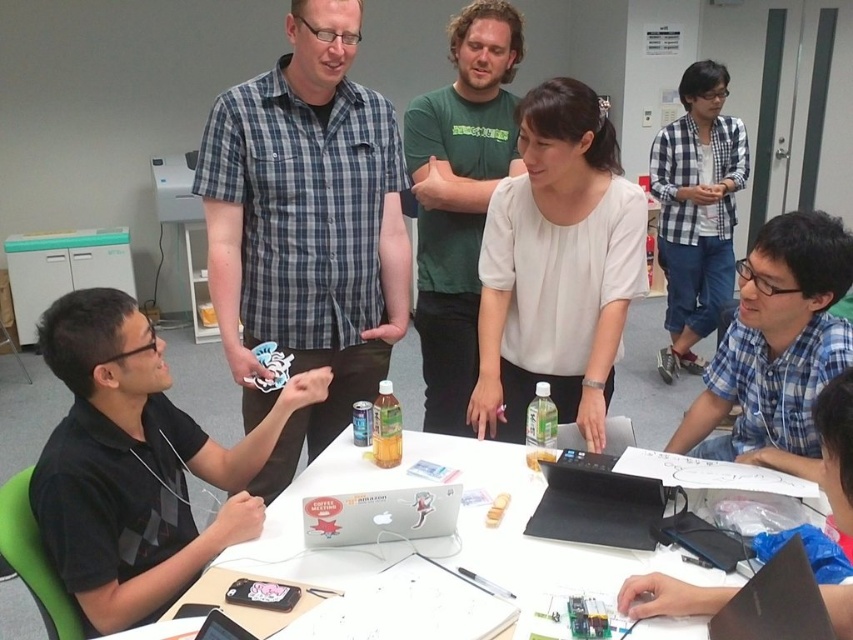
Question: Which point is farther to the camera?

Choices:
 (A) blue plaid shirt at center
 (B) blue plaid shirt at lower right
 (C) green cotton shirt at center

Answer: (C)

Question: Which point appears farthest from the camera in this image?

Choices:
 (A) (x=466, y=19)
 (B) (x=273, y=88)
 (C) (x=454, y=486)
 (D) (x=323, y=472)

Answer: (A)

Question: Can you confirm if blue plaid shirt at center is wider than white paper at center?

Choices:
 (A) yes
 (B) no

Answer: (B)

Question: Based on their relative distances, which object is nearer to the black matte shirt at left?

Choices:
 (A) green cotton shirt at center
 (B) checkered fabric shirt at upper right
 (C) silver metallic laptop at center

Answer: (C)

Question: Is checkered fabric shirt at upper right wider than blue plaid shirt at lower right?

Choices:
 (A) no
 (B) yes

Answer: (B)

Question: Is blue plaid shirt at center closer to the viewer compared to silver metallic laptop at center?

Choices:
 (A) no
 (B) yes

Answer: (A)